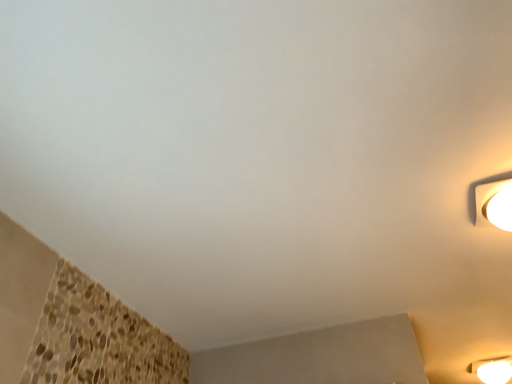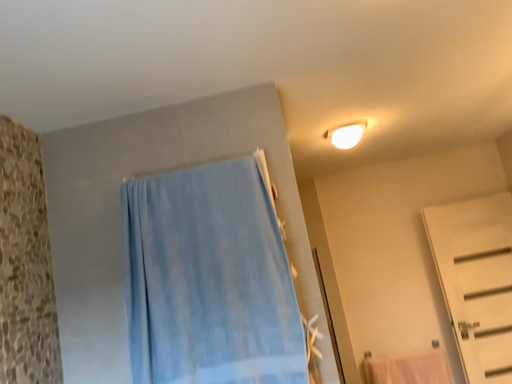
Question: Which way did the camera rotate in the video?

Choices:
 (A) rotated upward
 (B) rotated downward

Answer: (B)